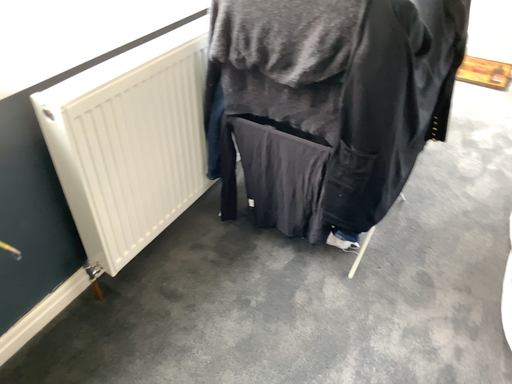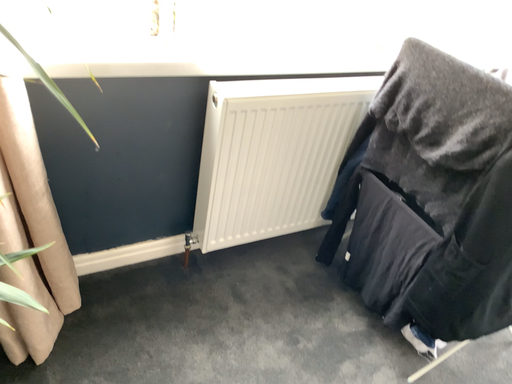
Question: How did the camera likely rotate when shooting the video?

Choices:
 (A) rotated downward
 (B) rotated upward

Answer: (B)